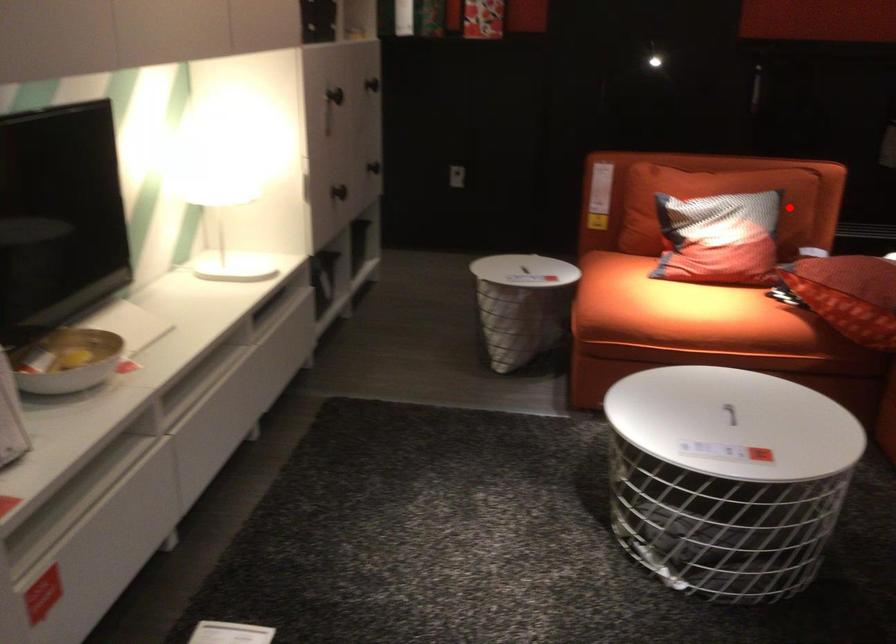
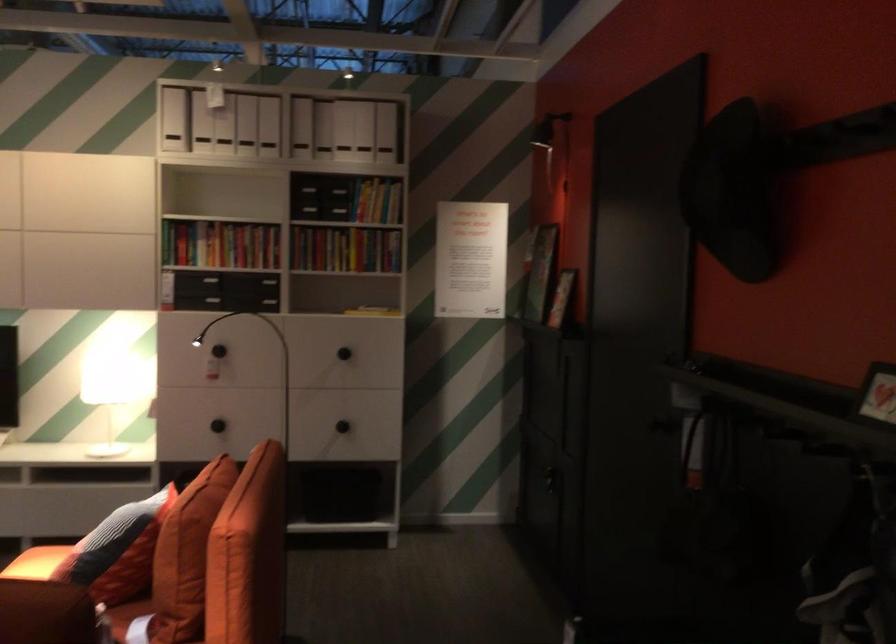
Question: A red point is marked in image1. In image2, is the corresponding 3D point closer to the camera or farther? Reply with the corresponding letter.

Choices:
 (A) The corresponding 3D point is closer.
 (B) The corresponding 3D point is farther.

Answer: (A)